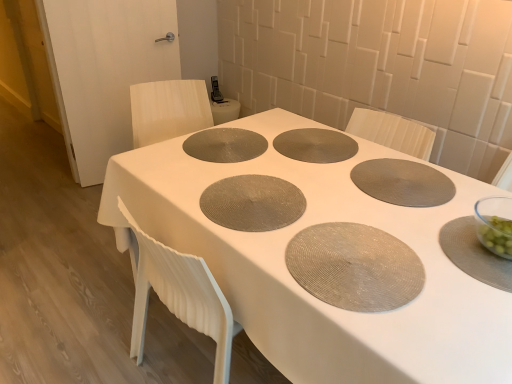
Locate an element on the screen. free area behind matte gray placemat at center, arranged as the first oval when ordered from the bottom is located at coordinates (339, 198).